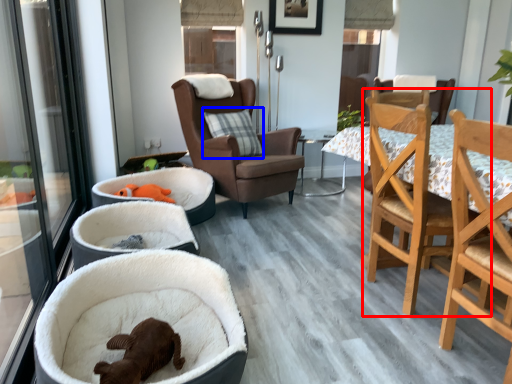
Question: Among these objects, which one is farthest to the camera, chair (highlighted by a red box) or pillow (highlighted by a blue box)?

Choices:
 (A) chair
 (B) pillow

Answer: (B)